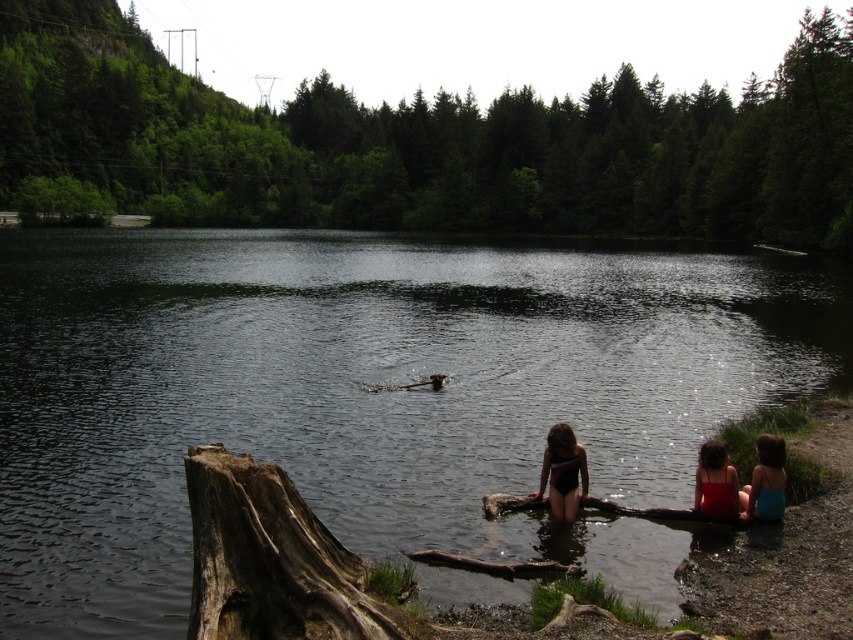
Question: Does black swimsuit at center appear on the left side of blue fabric swimsuit at lower right?

Choices:
 (A) no
 (B) yes

Answer: (B)

Question: Which object appears closest to the camera in this image?

Choices:
 (A) red fabric swimsuit at lower right
 (B) dark brown rough tree trunk at lower left
 (C) black swimsuit at center

Answer: (B)

Question: Considering the real-world distances, which object is closest to the dark water at center?

Choices:
 (A) blue fabric swimsuit at lower right
 (B) blue fabric swimsuits at lower right

Answer: (A)

Question: Can you confirm if dark water at center is positioned above blue fabric swimsuit at lower right?

Choices:
 (A) yes
 (B) no

Answer: (A)

Question: Is blue fabric swimsuit at lower right to the right of red fabric swimsuit at lower right from the viewer's perspective?

Choices:
 (A) yes
 (B) no

Answer: (A)

Question: Considering the real-world distances, which object is closest to the dark water at center?

Choices:
 (A) dark brown rough tree trunk at lower left
 (B) blue fabric swimsuit at lower right
 (C) red fabric swimsuit at lower right
 (D) black swimsuit at center

Answer: (A)